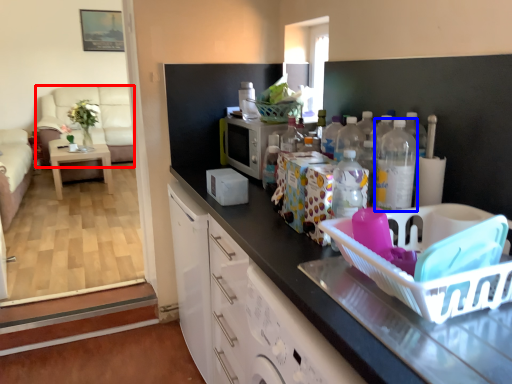
Question: Which point is closer to the camera, couch (highlighted by a red box) or bottle (highlighted by a blue box)?

Choices:
 (A) couch
 (B) bottle

Answer: (B)